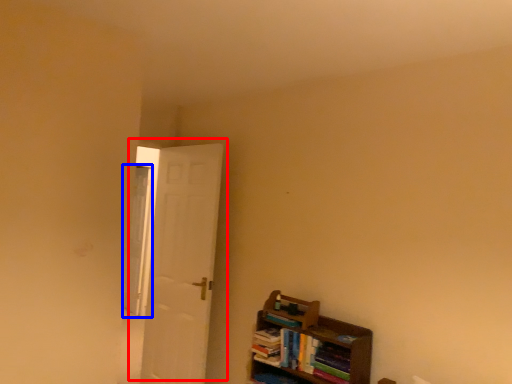
Question: Which of the following is the closest to the observer, door (highlighted by a red box) or window (highlighted by a blue box)?

Choices:
 (A) door
 (B) window

Answer: (A)